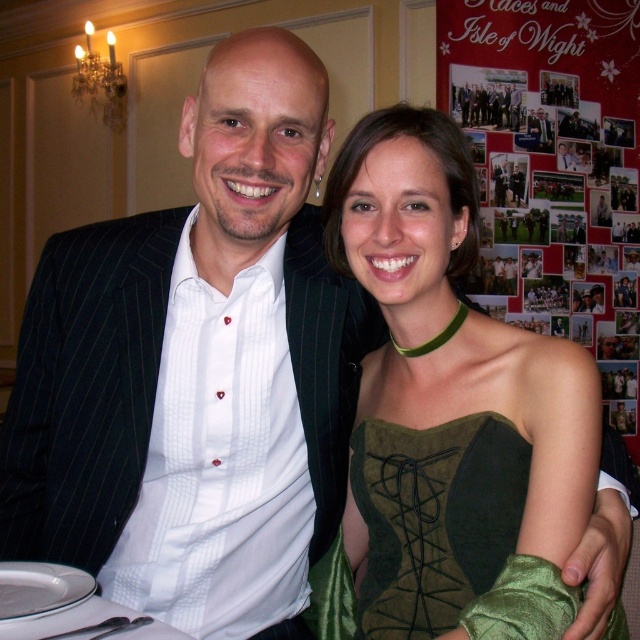
Question: Does green suede dress at center have a greater width compared to matte black suit at center?

Choices:
 (A) no
 (B) yes

Answer: (B)

Question: Among these objects, which one is farthest from the camera?

Choices:
 (A) green velvet corset at center
 (B) green suede dress at center
 (C) matte black suit at center

Answer: (C)

Question: Which object appears farthest from the camera in this image?

Choices:
 (A) matte black suit at center
 (B) green velvet corset at center

Answer: (A)

Question: Which object appears closest to the camera in this image?

Choices:
 (A) green suede dress at center
 (B) matte black suit at center

Answer: (A)

Question: Can you confirm if green suede dress at center is smaller than green velvet corset at center?

Choices:
 (A) yes
 (B) no

Answer: (B)

Question: Does green velvet corset at center come in front of matte black suit at center?

Choices:
 (A) yes
 (B) no

Answer: (A)